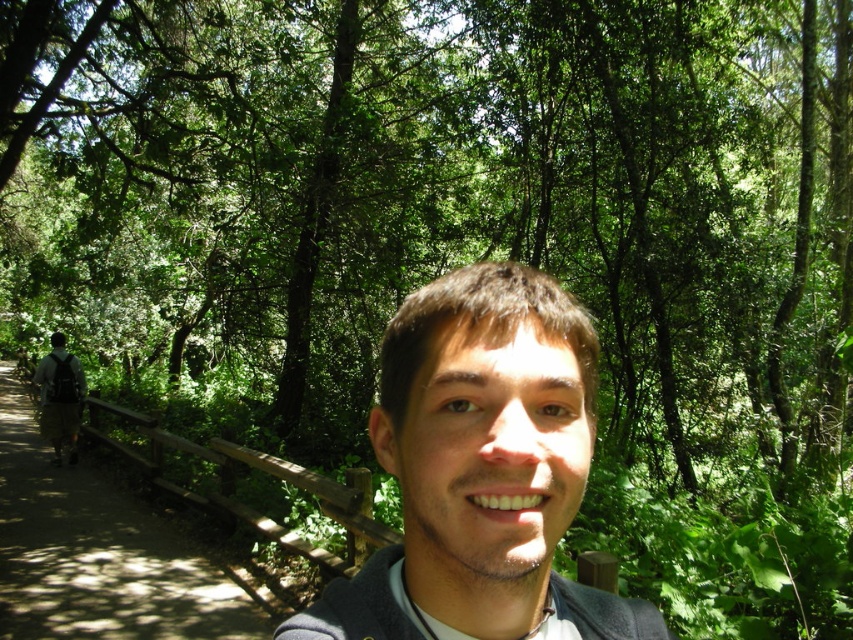
You are a photographer trying to capture both the smooth skin face at center and the brown wooden trail at left in the same frame. Based on their sizes in the image, which one appears smaller?

The smooth skin face at center appears smaller because it is not as tall as the brown wooden trail at left.

You are standing at the point marked by the coordinates point (480, 468) in the forest scene. What can you see at that exact location?

At point (480, 468) lies brown hair at center.